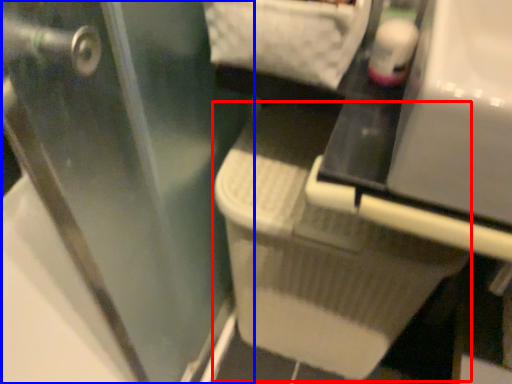
Question: Which point is closer to the camera, laundry basket (highlighted by a red box) or screen door (highlighted by a blue box)?

Choices:
 (A) laundry basket
 (B) screen door

Answer: (B)